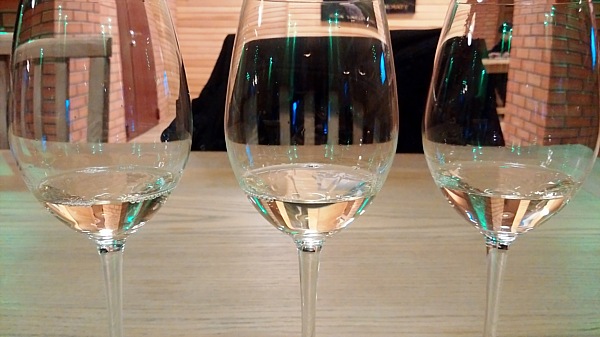
Where is `wall`? wall is located at coordinates pyautogui.click(x=192, y=25).